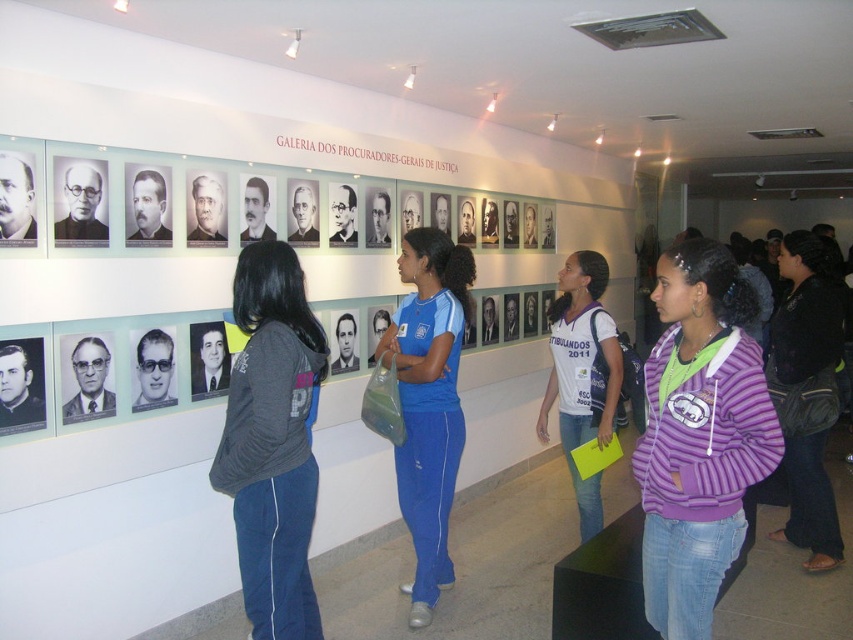
Question: Can you confirm if purple striped hoodie at lower right is smaller than black leather bag at right?

Choices:
 (A) no
 (B) yes

Answer: (B)

Question: Is dark gray hoodie at center closer to camera compared to blue track suit at center?

Choices:
 (A) no
 (B) yes

Answer: (B)

Question: Which of the following is the closest to the observer?

Choices:
 (A) purple fleece jacket at center
 (B) blue track suit at center
 (C) dark gray hoodie at center

Answer: (C)

Question: Which point appears farthest from the camera in this image?

Choices:
 (A) (767, 362)
 (B) (708, 540)
 (C) (265, 326)

Answer: (A)

Question: Which object is closer to the camera taking this photo?

Choices:
 (A) purple striped hoodie at lower right
 (B) black leather bag at right
 (C) purple fleece jacket at center

Answer: (A)

Question: Is dark gray hoodie at center further to the viewer compared to black leather bag at right?

Choices:
 (A) yes
 (B) no

Answer: (B)